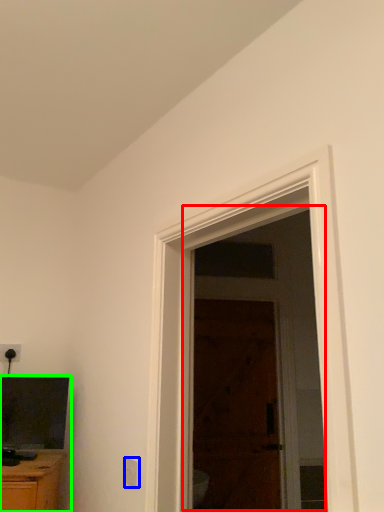
Question: Which object is positioned farthest from screen door (highlighted by a red box)? Select from electric outlet (highlighted by a blue box) and entertainment center (highlighted by a green box).

Choices:
 (A) electric outlet
 (B) entertainment center

Answer: (A)